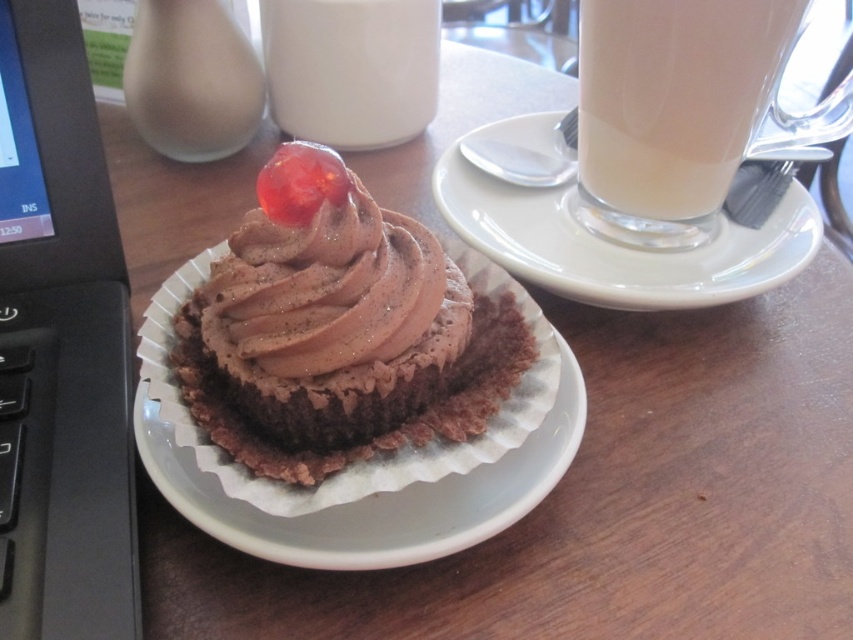
Can you confirm if white paper plate at center is positioned to the left of white glossy milkshake at upper center?

Incorrect, white paper plate at center is not on the left side of white glossy milkshake at upper center.

Who is positioned more to the left, white paper plate at center or white glossy milkshake at upper center?

white glossy milkshake at upper center

Is point (334, 490) positioned in front of point (352, 84)?

Yes, point (334, 490) is closer to viewer.

Locate an element on the screen. This screenshot has width=853, height=640. white paper plate at center is located at coordinates (368, 460).

Can you confirm if white frothy beverage at upper right is positioned above white glossy milkshake at upper center?

No.

Which is below, white frothy beverage at upper right or white glossy milkshake at upper center?

white frothy beverage at upper right

Who is more distant from viewer, (633, 42) or (294, 113)?

Point (294, 113)

Locate an element on the screen. white frothy beverage at upper right is located at coordinates (671, 109).

Can you confirm if white paper plate at upper right is smaller than white glossy milkshake at upper center?

Incorrect, white paper plate at upper right is not smaller in size than white glossy milkshake at upper center.

In the scene shown: Is white paper plate at upper right above white glossy milkshake at upper center?

Incorrect, white paper plate at upper right is not positioned above white glossy milkshake at upper center.

Which is in front, point (572, 234) or point (282, 17)?

Positioned in front is point (572, 234).

In order to click on white paper plate at upper right in this screenshot , I will do `click(612, 241)`.